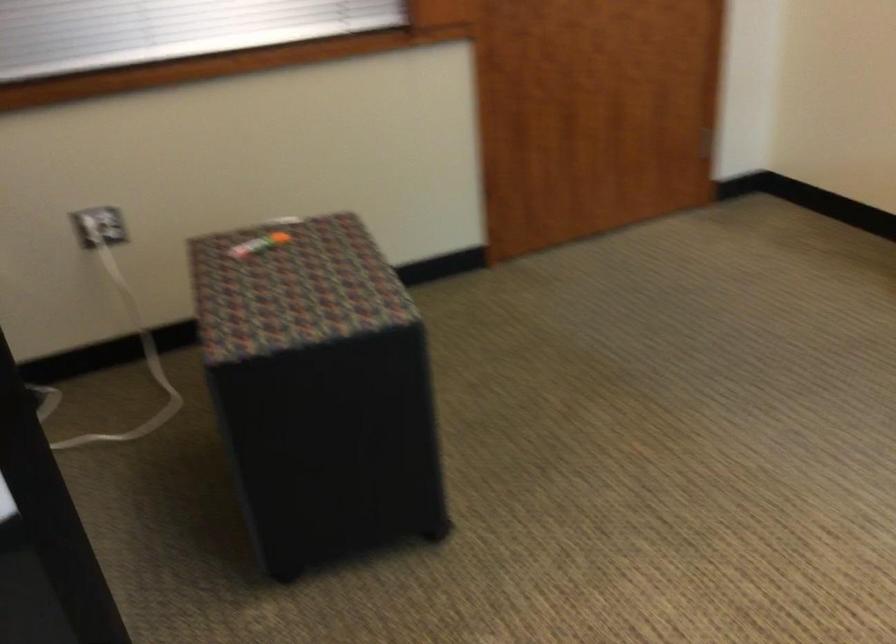
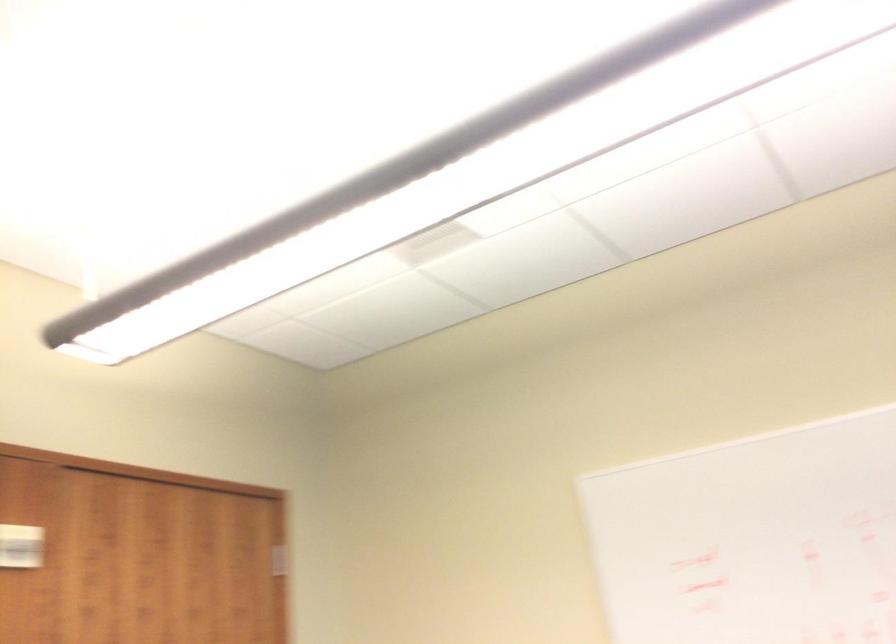
First-person continuous shooting, in which direction is the camera rotating?

The camera rotated toward right-up.